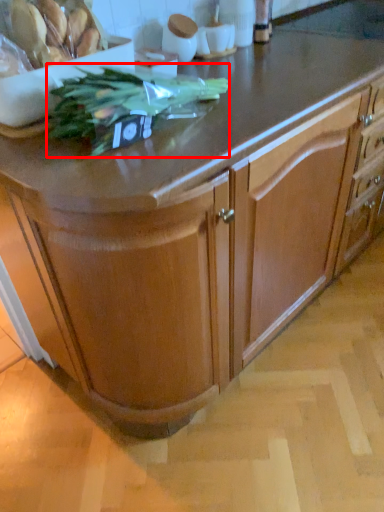
Question: Where is plant (annotated by the red box) located in relation to food in the image?

Choices:
 (A) right
 (B) left

Answer: (A)